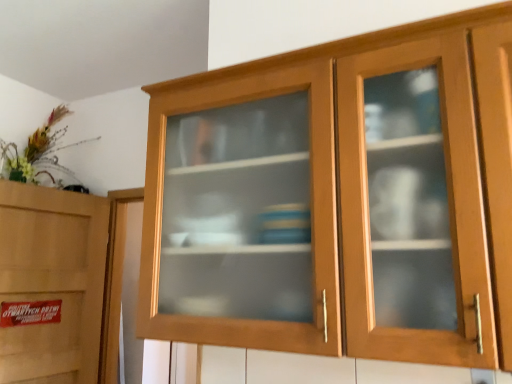
Describe the element at coordinates (52, 281) in the screenshot. Image resolution: width=512 pixels, height=384 pixels. I see `matte wood cabinet at left` at that location.

Locate an element on the screen. matte wood cabinet at left is located at coordinates (52, 281).

The width and height of the screenshot is (512, 384). What do you see at coordinates (268, 95) in the screenshot?
I see `wooden cabinet at center` at bounding box center [268, 95].

What is the approximate height of wooden cabinet at center?

30.71 inches.

This screenshot has width=512, height=384. I want to click on wooden cabinet at center, so click(x=268, y=95).

Where is `matte wood cabinet at left`? This screenshot has width=512, height=384. matte wood cabinet at left is located at coordinates (52, 281).

In the image, is matte wood cabinet at left on the left side or the right side of wooden cabinet at center?

Based on their positions, matte wood cabinet at left is located to the left of wooden cabinet at center.

Considering the positions of objects matte wood cabinet at left and wooden cabinet at center in the image provided, who is behind, matte wood cabinet at left or wooden cabinet at center?

Positioned behind is matte wood cabinet at left.

Is point (71, 311) positioned behind point (436, 335)?

Yes.

From the image's perspective, is matte wood cabinet at left located above wooden cabinet at center?

Actually, matte wood cabinet at left appears below wooden cabinet at center in the image.

From a real-world perspective, does matte wood cabinet at left stand above wooden cabinet at center?

No, from a real-world perspective, matte wood cabinet at left is not over wooden cabinet at center

In terms of width, does matte wood cabinet at left look wider or thinner when compared to wooden cabinet at center?

Considering their sizes, matte wood cabinet at left looks slimmer than wooden cabinet at center.

In the scene shown: From their relative heights in the image, would you say matte wood cabinet at left is taller or shorter than wooden cabinet at center?

Clearly, matte wood cabinet at left is taller compared to wooden cabinet at center.

Is matte wood cabinet at left bigger than wooden cabinet at center?

Actually, matte wood cabinet at left might be smaller than wooden cabinet at center.

Is matte wood cabinet at left inside the boundaries of wooden cabinet at center, or outside?

matte wood cabinet at left is located beyond the bounds of wooden cabinet at center.

Is matte wood cabinet at left positioned far away from wooden cabinet at center?

Yes, matte wood cabinet at left and wooden cabinet at center are located far from each other.

Is matte wood cabinet at left turned away from wooden cabinet at center?

That's not correct — matte wood cabinet at left is not looking away from wooden cabinet at center.

How much distance is there between matte wood cabinet at left and wooden cabinet at center?

matte wood cabinet at left and wooden cabinet at center are 1.47 meters apart.

The height and width of the screenshot is (384, 512). Find the location of `cabinetry that appears behind the wooden cabinet at center`. cabinetry that appears behind the wooden cabinet at center is located at coordinates (52, 281).

Does wooden cabinet at center appear on the left side of matte wood cabinet at left?

Incorrect, wooden cabinet at center is not on the left side of matte wood cabinet at left.

Is wooden cabinet at center closer to the viewer compared to matte wood cabinet at left?

Yes, wooden cabinet at center is closer to the viewer.

Is point (158, 241) in front of point (27, 276)?

Yes, it is.

From the image's perspective, who appears lower, wooden cabinet at center or matte wood cabinet at left?

From the image's view, matte wood cabinet at left is below.

From a real-world perspective, does wooden cabinet at center sit lower than matte wood cabinet at left?

No, from a real-world perspective, wooden cabinet at center is not below matte wood cabinet at left.

In terms of width, does wooden cabinet at center look wider or thinner when compared to matte wood cabinet at left?

Clearly, wooden cabinet at center has more width compared to matte wood cabinet at left.

Considering the relative sizes of wooden cabinet at center and matte wood cabinet at left in the image provided, is wooden cabinet at center shorter than matte wood cabinet at left?

Correct, wooden cabinet at center is not as tall as matte wood cabinet at left.

Can you confirm if wooden cabinet at center is smaller than matte wood cabinet at left?

No, wooden cabinet at center is not smaller than matte wood cabinet at left.

Is wooden cabinet at center positioned beyond the bounds of matte wood cabinet at left?

Absolutely, wooden cabinet at center is external to matte wood cabinet at left.

Is wooden cabinet at center not close to matte wood cabinet at left?

Yes, wooden cabinet at center and matte wood cabinet at left are located far from each other.

Is wooden cabinet at center positioned with its back to matte wood cabinet at left?

No, wooden cabinet at center is not facing away from matte wood cabinet at left.

How many degrees apart are the facing directions of wooden cabinet at center and matte wood cabinet at left?

The angular difference between wooden cabinet at center and matte wood cabinet at left is 83.3 degrees.

This screenshot has height=384, width=512. In order to click on cabinetry behind the wooden cabinet at center in this screenshot , I will do `click(52, 281)`.

The image size is (512, 384). Find the location of `cabinetry behind the wooden cabinet at center`. cabinetry behind the wooden cabinet at center is located at coordinates (52, 281).

Identify the location of cupboard in front of the matte wood cabinet at left. (268, 95).